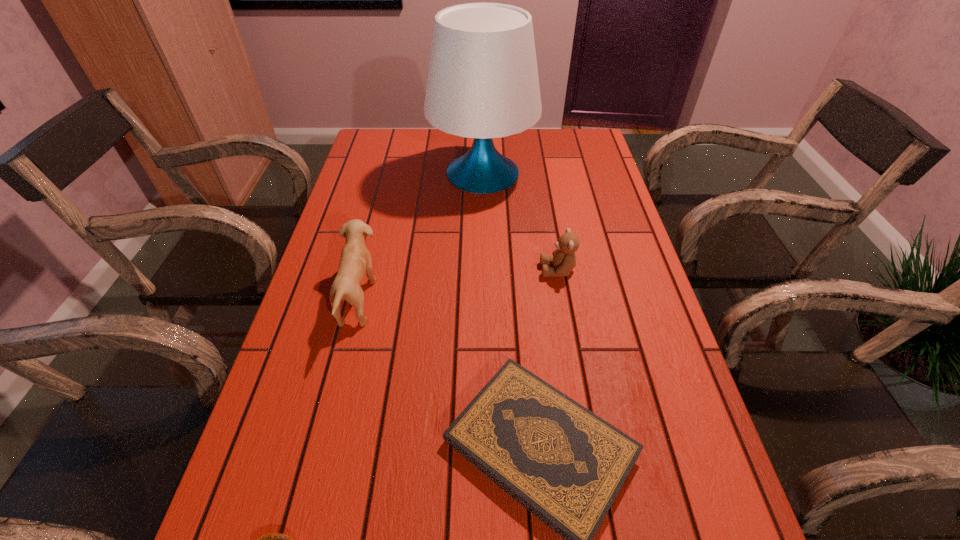
Image resolution: width=960 pixels, height=540 pixels. What are the coordinates of `object identified as the third closest to the third shortest object` in the screenshot? It's located at (355, 261).

Select which object appears as the third closest to the puppy. Please provide its 2D coordinates. Your answer should be formatted as a tuple, i.e. [(x, y)], where the tuple contains the x and y coordinates of a point satisfying the conditions above.

[(272, 539)]